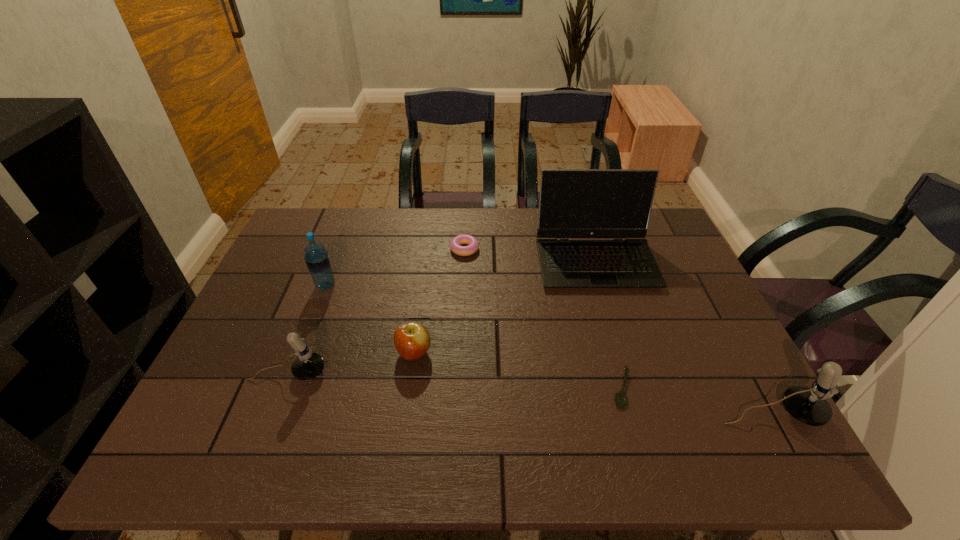
Find the location of `free space at the left edge of the desktop`. free space at the left edge of the desktop is located at coordinates (241, 327).

Locate an element on the screen. The width and height of the screenshot is (960, 540). free space at the right edge of the desktop is located at coordinates (707, 340).

I want to click on vacant region between the soupspoon and the tallest object, so click(x=609, y=325).

Find the location of a particular element. This screenshot has width=960, height=540. vacant area between the soupspoon and the taller microphone is located at coordinates (696, 401).

Identify the location of unoccupied area between the nearer microphone and the second shortest object. (617, 331).

Locate an element on the screen. free spot between the apple and the right microphone is located at coordinates 592,383.

I want to click on blank region between the fifth object from right to left and the shortest object, so click(x=518, y=371).

The width and height of the screenshot is (960, 540). I want to click on vacant area that lies between the farther microphone and the shortest object, so click(455, 381).

Locate an element on the screen. This screenshot has height=540, width=960. vacant area that lies between the right microphone and the sixth tallest object is located at coordinates (617, 331).

At what (x,y) coordinates should I click in order to perform the action: click on free space between the right microphone and the doughnut. Please return your answer as a coordinate pair (x, y). The width and height of the screenshot is (960, 540). Looking at the image, I should click on (617, 331).